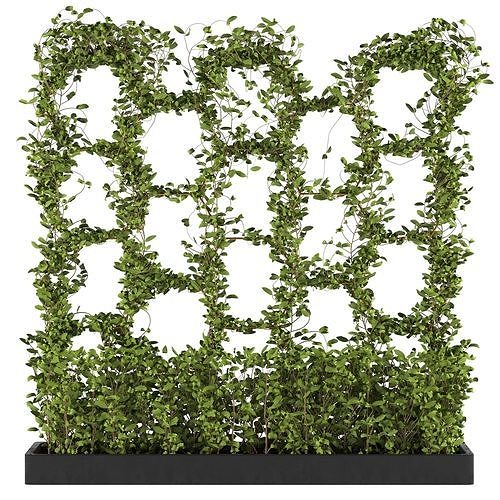
Find the location of a particular element. The image size is (500, 500). black planter box is located at coordinates (330, 461).